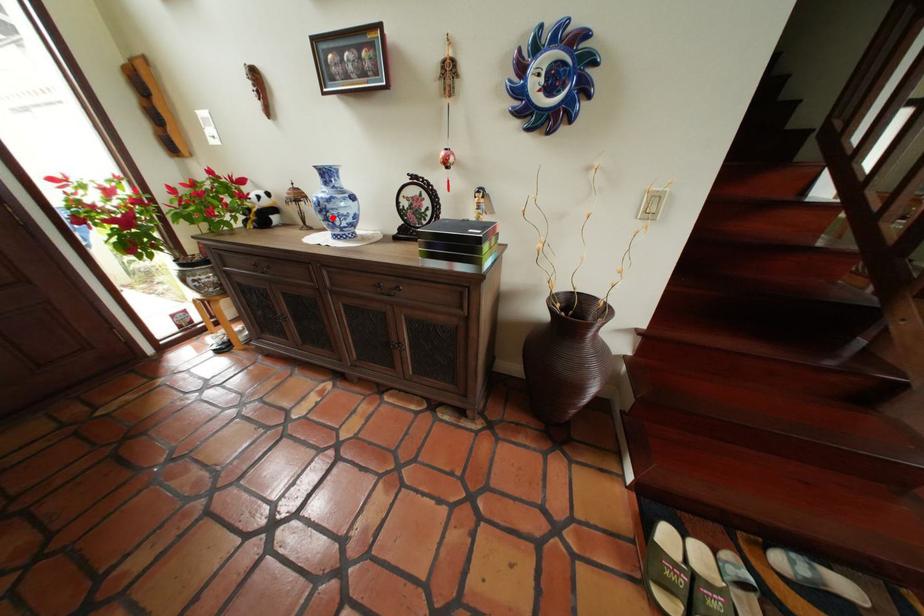
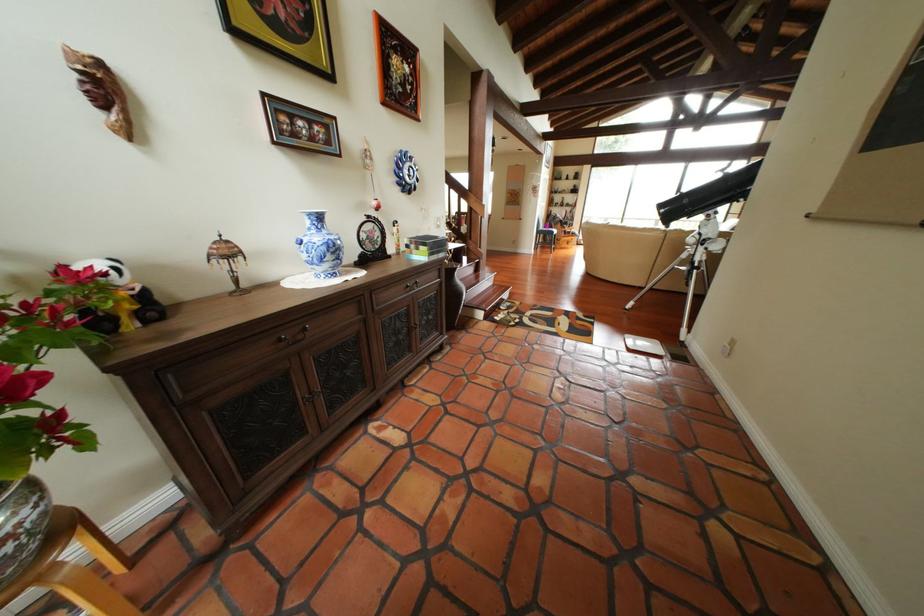
Where in the second image is the point corresponding to the highlighted location from the first image?

(342, 257)